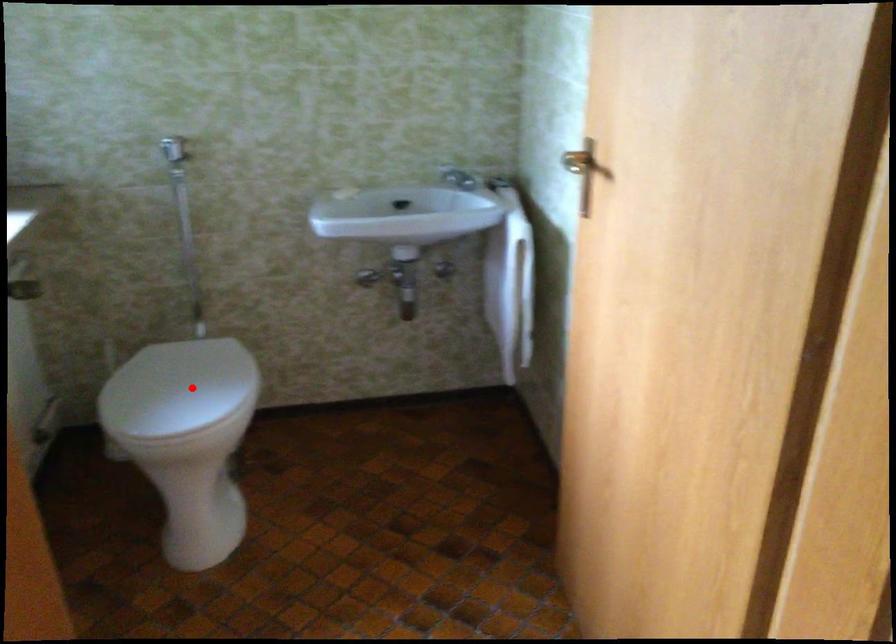
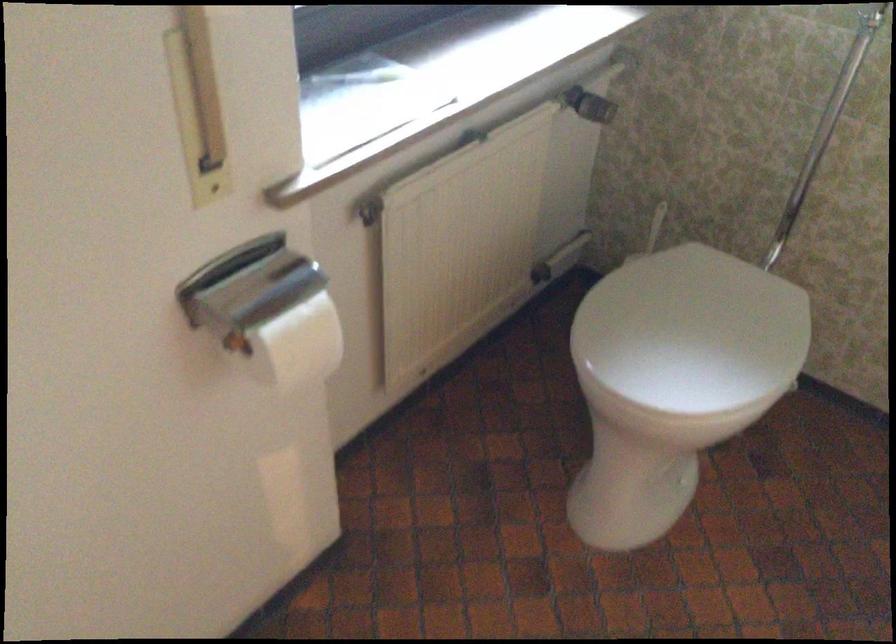
Find the pixel in the second image that matches the highlighted location in the first image.

(692, 330)